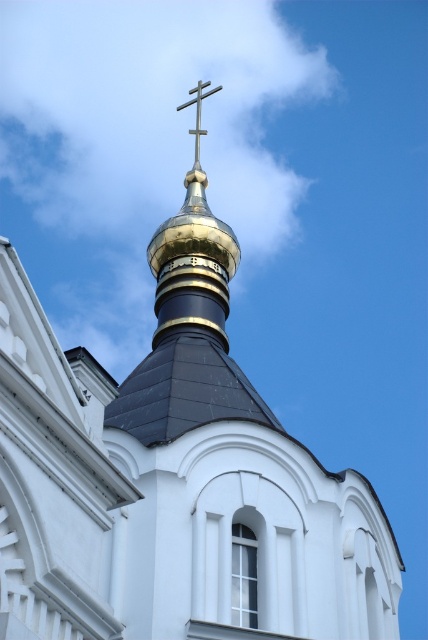
You are an architect analyzing the building structure. You need to determine which object occupies more space in the image between the gold polished dome at upper center and the gold metallic cross at upper center. Based on their sizes, which one would you say is bigger?

The gold polished dome at upper center has a larger size compared to the gold metallic cross at upper center, so the gold polished dome at upper center occupies more space in the image.

You are an architect designing a new religious edifice. You want to place a golden cross on top of the gold polished dome at upper center. The cross you have is 210.89 feet tall. Will the cross fit on the dome?

The gold polished dome at upper center is 210.89 feet apart from the cross, so the cross will not fit on the dome because it is the same height as the distance between them.